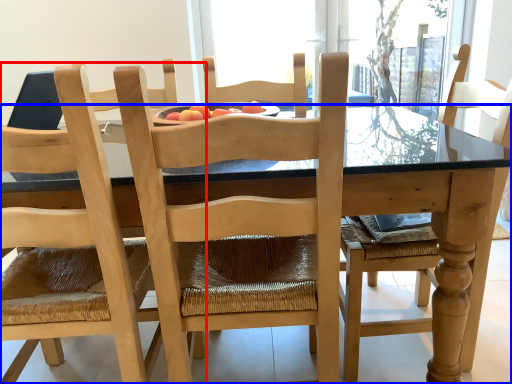
Question: Which object is further to the camera taking this photo, chair (highlighted by a red box) or kitchen & dining room table (highlighted by a blue box)?

Choices:
 (A) chair
 (B) kitchen & dining room table

Answer: (B)